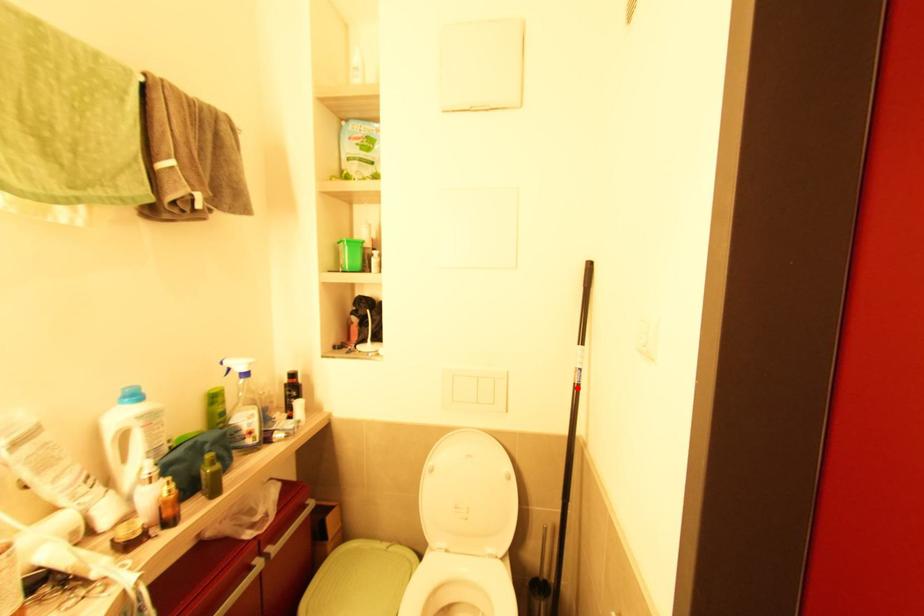
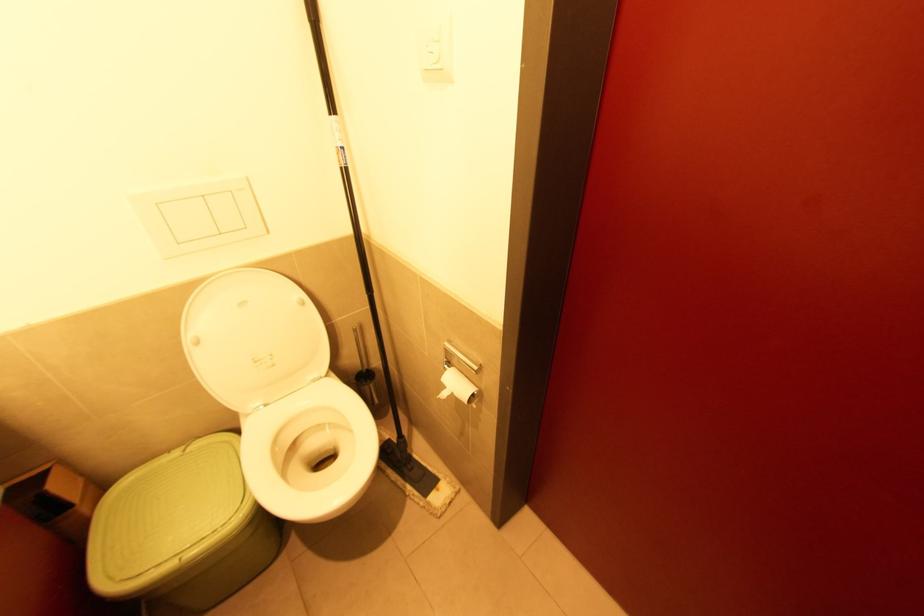
Locate, in the second image, the point that corresponds to the highlighted location in the first image.

(347, 172)